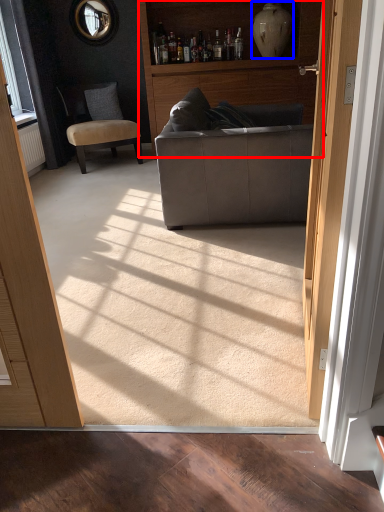
Question: Which object appears farthest to the camera in this image, bookshelf (highlighted by a red box) or vase (highlighted by a blue box)?

Choices:
 (A) bookshelf
 (B) vase

Answer: (B)